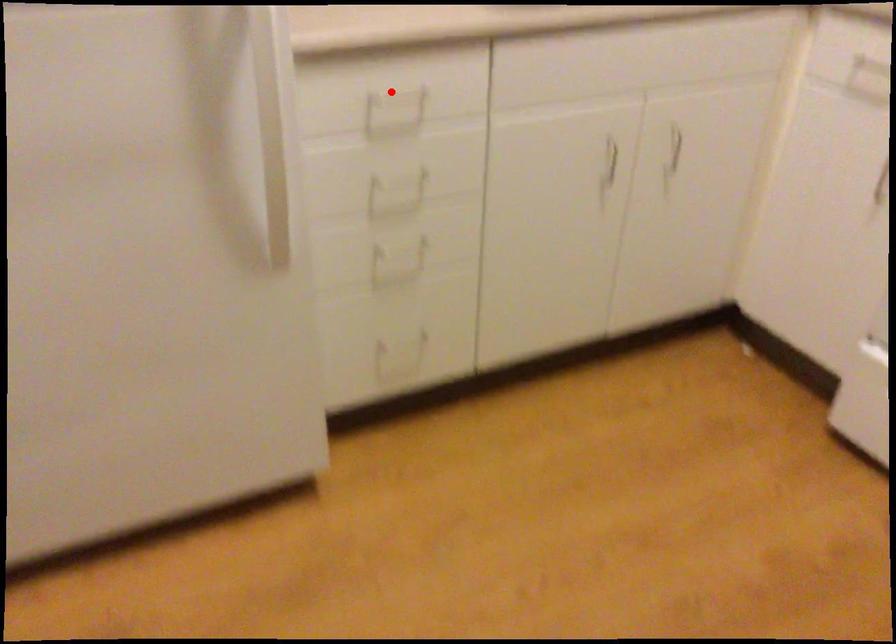
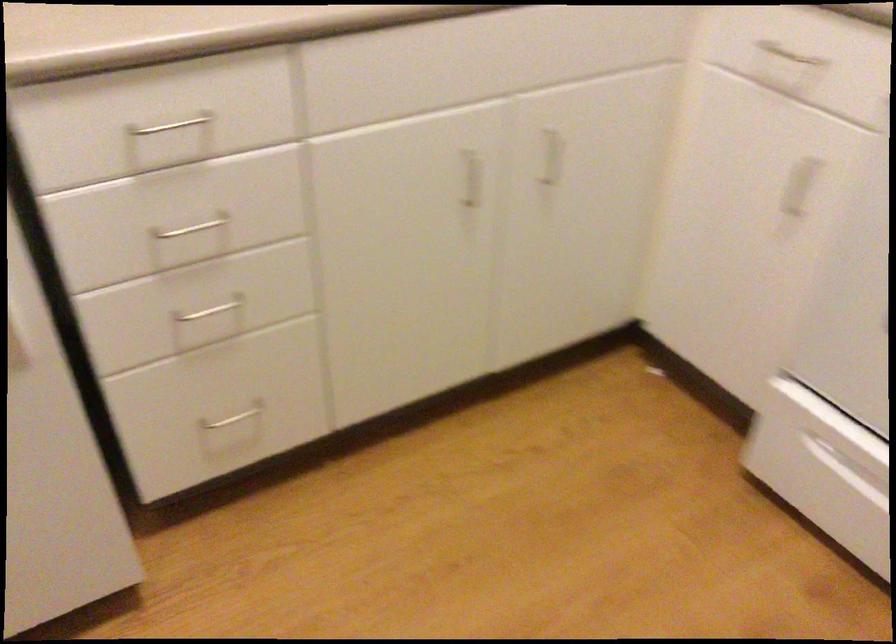
Where in the second image is the point corresponding to the highlighted location from the first image?

(170, 125)